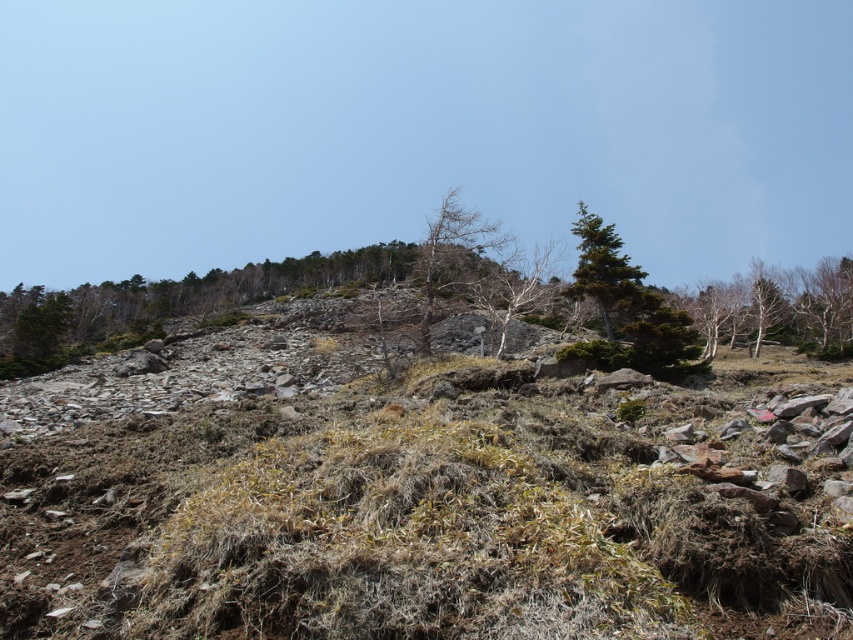
Is bare bark trees at upper right bigger than green textured tree at upper center?

Correct, bare bark trees at upper right is larger in size than green textured tree at upper center.

How much distance is there between bare bark trees at upper right and green textured tree at upper center?

bare bark trees at upper right and green textured tree at upper center are 14.54 meters apart.

The image size is (853, 640). What do you see at coordinates (779, 308) in the screenshot? I see `bare bark trees at upper right` at bounding box center [779, 308].

Find the location of a particular element. Image resolution: width=853 pixels, height=640 pixels. bare bark trees at upper right is located at coordinates (779, 308).

Who is lower down, bare wood tree at center or green textured tree at upper center?

green textured tree at upper center is below.

Can you confirm if bare wood tree at center is smaller than green textured tree at upper center?

Incorrect, bare wood tree at center is not smaller in size than green textured tree at upper center.

You are a GUI agent. You are given a task and a screenshot of the screen. Output one action in this format:
    pyautogui.click(x=<x>, y=<y>)
    Task: Click on the bare wood tree at center
    
    Given the screenshot: What is the action you would take?
    pyautogui.click(x=451, y=259)

Can you confirm if bare bark trees at upper right is taller than bare wood tree at center?

In fact, bare bark trees at upper right may be shorter than bare wood tree at center.

Is bare bark trees at upper right above bare wood tree at center?

No.

Is point (838, 284) farther from camera compared to point (428, 253)?

Yes, it is.

This screenshot has height=640, width=853. I want to click on bare bark trees at upper right, so click(779, 308).